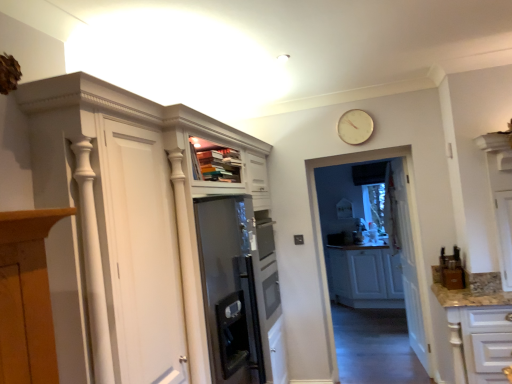
Question: Does white matte cabinet at center, the first cabinetry from the back, appear on the left side of white glossy cabinet at lower right, the 1th cabinetry when ordered from front to back?

Choices:
 (A) yes
 (B) no

Answer: (B)

Question: Is white matte cabinet at center, the second cabinetry from the front, next to white glossy cabinet at lower right, the 1th cabinetry when ordered from front to back, and touching it?

Choices:
 (A) no
 (B) yes

Answer: (A)

Question: Does white matte cabinet at center, the second cabinetry from the front, have a greater width compared to white glossy cabinet at lower right, the 1th cabinetry when ordered from front to back?

Choices:
 (A) yes
 (B) no

Answer: (B)

Question: Is white matte cabinet at center, the first cabinetry from the back, facing towards white glossy cabinet at lower right, the 1th cabinetry when ordered from front to back?

Choices:
 (A) yes
 (B) no

Answer: (A)

Question: Is white matte cabinet at center, the first cabinetry from the back, facing away from white glossy cabinet at lower right, positioned as the second cabinetry in back-to-front order?

Choices:
 (A) yes
 (B) no

Answer: (B)

Question: Is white wooden door at center in front of or behind white glossy cabinet at lower right, positioned as the second cabinetry in back-to-front order, in the image?

Choices:
 (A) behind
 (B) front

Answer: (A)

Question: Is point (420, 339) closer or farther from the camera than point (480, 379)?

Choices:
 (A) farther
 (B) closer

Answer: (A)

Question: From a real-world perspective, relative to white glossy cabinet at lower right, the 1th cabinetry when ordered from front to back, is white wooden door at center vertically above or below?

Choices:
 (A) above
 (B) below

Answer: (A)

Question: Is white wooden door at center bigger or smaller than white glossy cabinet at lower right, the 1th cabinetry when ordered from front to back?

Choices:
 (A) big
 (B) small

Answer: (B)

Question: From their relative heights in the image, would you say transparent glass door at center is taller or shorter than gold metallic clock at upper center?

Choices:
 (A) short
 (B) tall

Answer: (B)

Question: In terms of size, does transparent glass door at center appear bigger or smaller than gold metallic clock at upper center?

Choices:
 (A) small
 (B) big

Answer: (B)

Question: In terms of width, does transparent glass door at center look wider or thinner when compared to gold metallic clock at upper center?

Choices:
 (A) wide
 (B) thin

Answer: (A)

Question: Based on their positions, is transparent glass door at center located to the left or right of gold metallic clock at upper center?

Choices:
 (A) left
 (B) right

Answer: (B)

Question: Is point (463, 342) positioned closer to the camera than point (428, 350)?

Choices:
 (A) closer
 (B) farther

Answer: (A)

Question: In terms of size, does white glossy cabinet at lower right, the 1th cabinetry when ordered from front to back, appear bigger or smaller than white wooden door at center?

Choices:
 (A) small
 (B) big

Answer: (B)